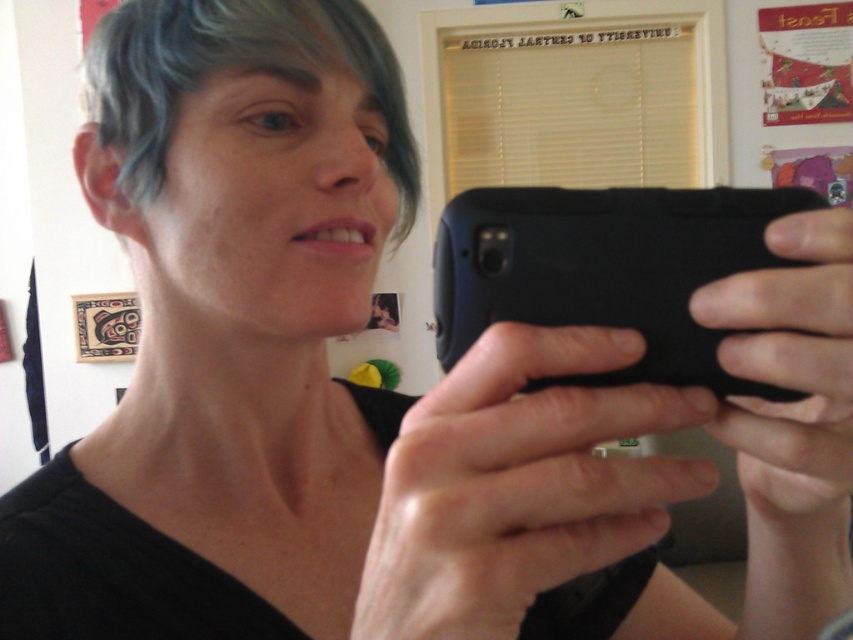
Question: Can you confirm if black matte phone at center is positioned to the left of gray matte hair at upper left?

Choices:
 (A) yes
 (B) no

Answer: (B)

Question: Among these objects, which one is nearest to the camera?

Choices:
 (A) black matte phone at center
 (B) gray matte hair at upper left

Answer: (A)

Question: Does black matte phone at center appear on the right side of gray matte hair at upper left?

Choices:
 (A) no
 (B) yes

Answer: (B)

Question: Which point is farther to the camera?

Choices:
 (A) (344, 33)
 (B) (666, 196)

Answer: (A)

Question: Is black matte phone at center closer to the viewer compared to gray matte hair at upper left?

Choices:
 (A) no
 (B) yes

Answer: (B)

Question: Which point appears closest to the camera in this image?

Choices:
 (A) [x=416, y=198]
 (B) [x=564, y=312]

Answer: (B)